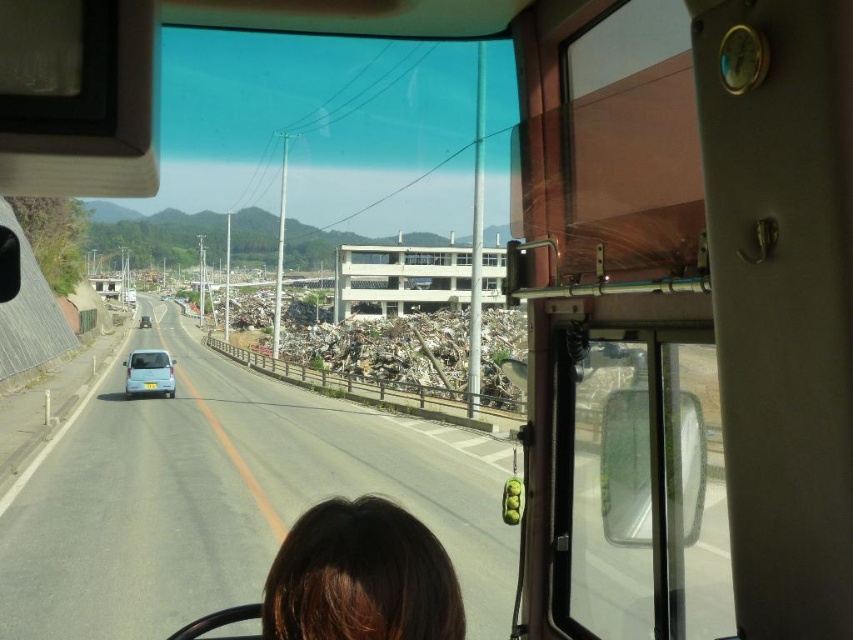
Does transparent plastic windshield at center have a larger size compared to brown hair at lower center?

Yes.

Image resolution: width=853 pixels, height=640 pixels. What do you see at coordinates (637, 484) in the screenshot? I see `transparent plastic windshield at center` at bounding box center [637, 484].

Is point (561, 496) closer to viewer compared to point (386, 625)?

No, it is behind (386, 625).

Where is `transparent plastic windshield at center`? The image size is (853, 640). transparent plastic windshield at center is located at coordinates (637, 484).

Does asphalt road at center have a greater width compared to transparent plastic windshield at center?

Yes, asphalt road at center is wider than transparent plastic windshield at center.

How much distance is there between asphalt road at center and transparent plastic windshield at center?

asphalt road at center and transparent plastic windshield at center are 4.95 meters apart from each other.

Between point (279, 499) and point (579, 529), which one is positioned behind?

The point (279, 499) is behind.

The height and width of the screenshot is (640, 853). I want to click on asphalt road at center, so coord(225,499).

How much distance is there between brown hair at lower center and light blue matte car at center?

A distance of 22.41 meters exists between brown hair at lower center and light blue matte car at center.

Between point (308, 548) and point (155, 358), which one is positioned behind?

The point (155, 358) is behind.

Where is `brown hair at lower center`? This screenshot has height=640, width=853. brown hair at lower center is located at coordinates (361, 577).